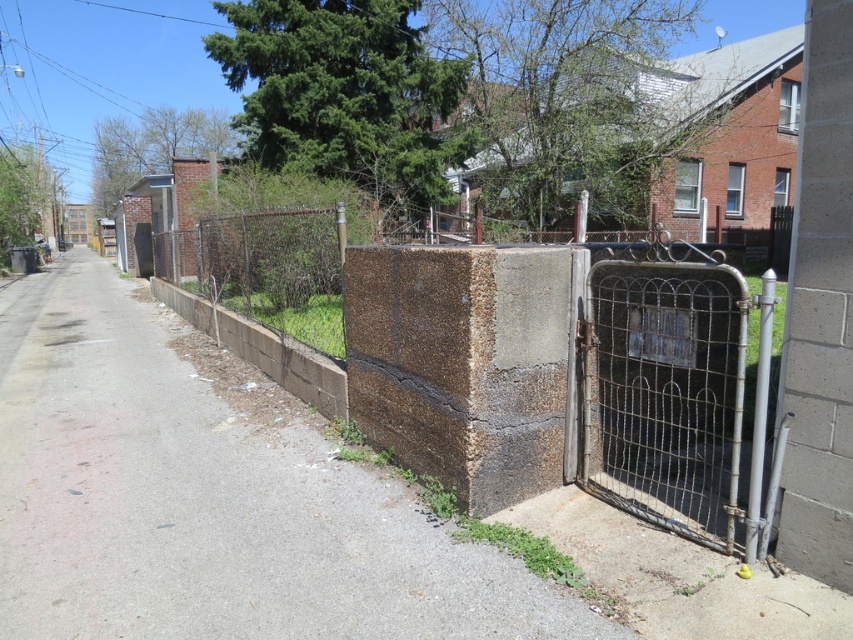
Who is positioned more to the left, brown concrete wall at center or rusty metal gate at center right?

brown concrete wall at center is more to the left.

Which is behind, point (717, 461) or point (699, 266)?

The point (717, 461) is behind.

The image size is (853, 640). Find the location of `brown concrete wall at center`. brown concrete wall at center is located at coordinates (561, 378).

You are a GUI agent. You are given a task and a screenshot of the screen. Output one action in this format:
    pyautogui.click(x=<x>, y=<y>)
    Task: Click on the brown concrete wall at center
    This screenshot has height=640, width=853.
    Given the screenshot: What is the action you would take?
    pyautogui.click(x=561, y=378)

Between brown concrete wall at center-right and rusty metal gate at center right, which one is positioned lower?

Positioned lower is brown concrete wall at center-right.

Is the position of brown concrete wall at center-right less distant than that of rusty metal gate at center right?

Yes, it is.

Between point (277, 400) and point (659, 348), which one is positioned in front?

Point (659, 348)

Find the location of `brown concrete wall at center-right`. brown concrete wall at center-right is located at coordinates (212, 497).

Is brown concrete wall at center-right bigger than brown concrete wall at center?

Correct, brown concrete wall at center-right is larger in size than brown concrete wall at center.

Describe the element at coordinates (212, 497) in the screenshot. I see `brown concrete wall at center-right` at that location.

Between point (143, 416) and point (428, 340), which one is positioned in front?

Point (428, 340) is more forward.

Locate an element on the screen. This screenshot has height=640, width=853. brown concrete wall at center-right is located at coordinates (212, 497).